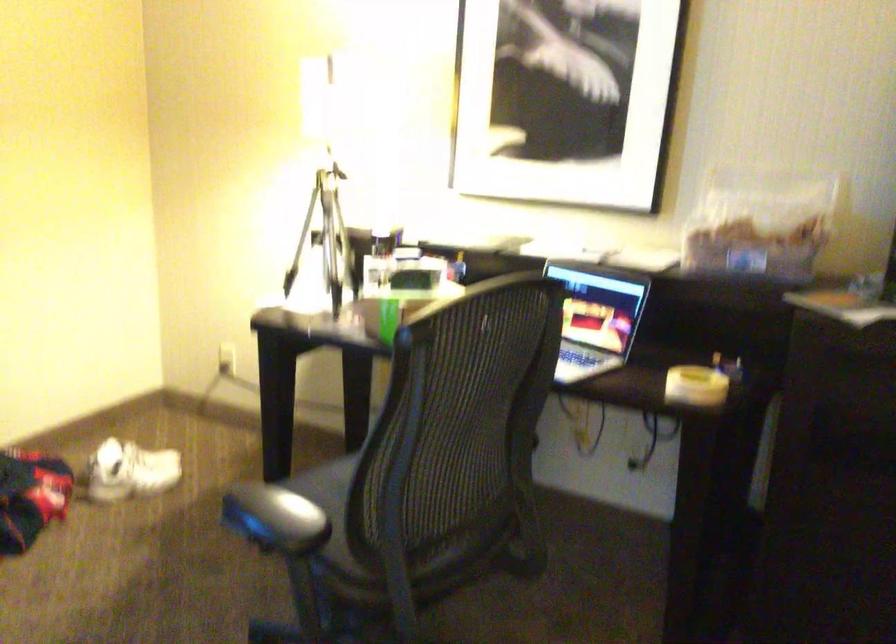
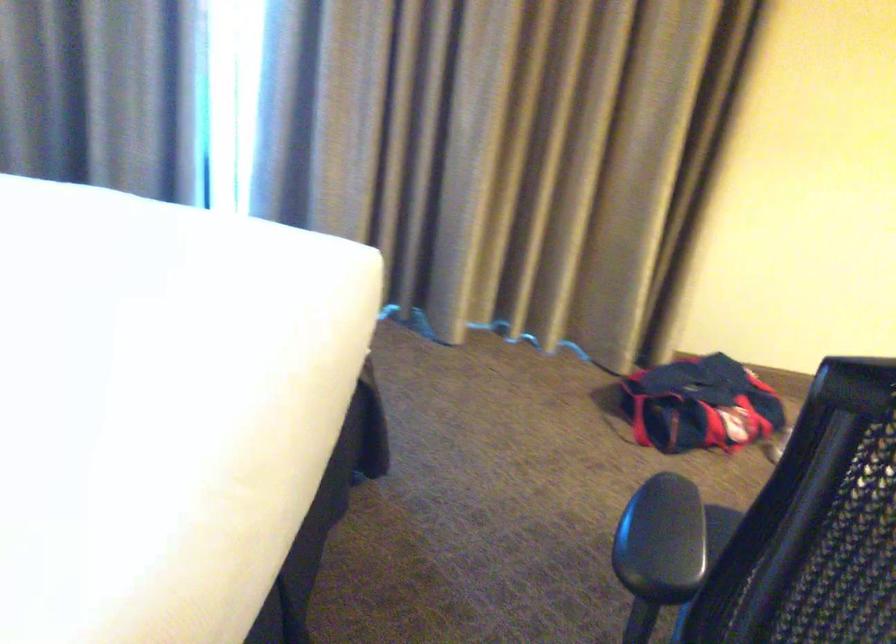
First-person continuous shooting, in which direction is the camera rotating?

The camera rotated toward left-down.